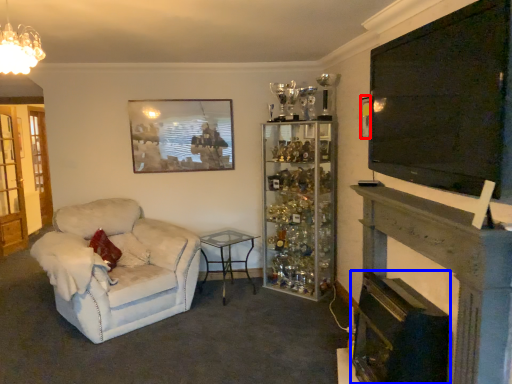
Question: Which object appears closest to the camera in this image, picture frame (highlighted by a red box) or fireplace (highlighted by a blue box)?

Choices:
 (A) picture frame
 (B) fireplace

Answer: (B)